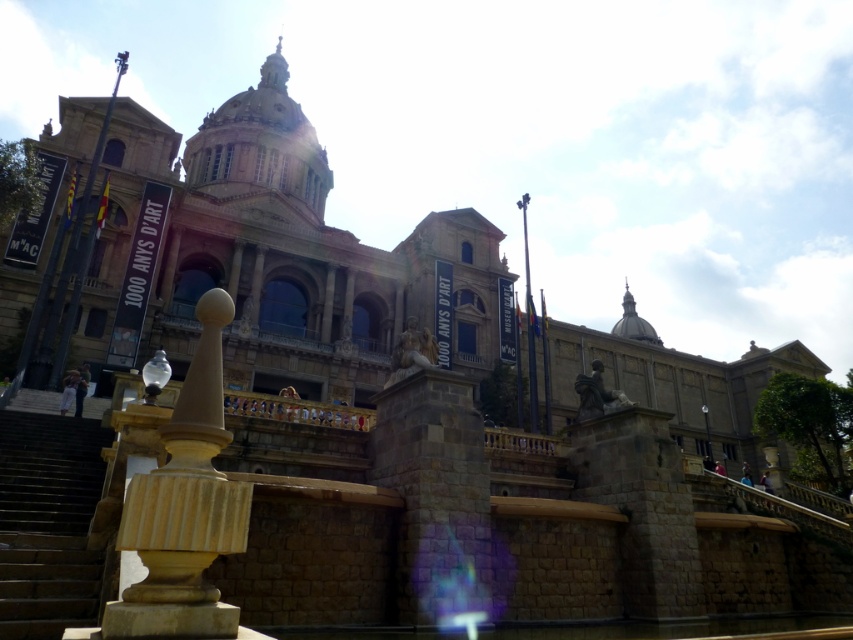
Question: Estimate the real-world distances between objects in this image. Which object is closer to the beige polished stone pillar at center?

Choices:
 (A) brown stone stairs at lower left
 (B) brown stone church at center

Answer: (A)

Question: Which of these objects is positioned farthest from the beige polished stone pillar at center?

Choices:
 (A) brown stone church at center
 (B) brown stone stairs at lower left

Answer: (A)

Question: Does brown stone church at center appear over beige polished stone pillar at center?

Choices:
 (A) yes
 (B) no

Answer: (A)

Question: Which point is closer to the camera?

Choices:
 (A) brown stone stairs at lower left
 (B) brown stone church at center

Answer: (A)

Question: Does beige polished stone pillar at center appear under brown stone stairs at lower left?

Choices:
 (A) yes
 (B) no

Answer: (B)

Question: Does beige polished stone pillar at center appear under brown stone stairs at lower left?

Choices:
 (A) yes
 (B) no

Answer: (B)